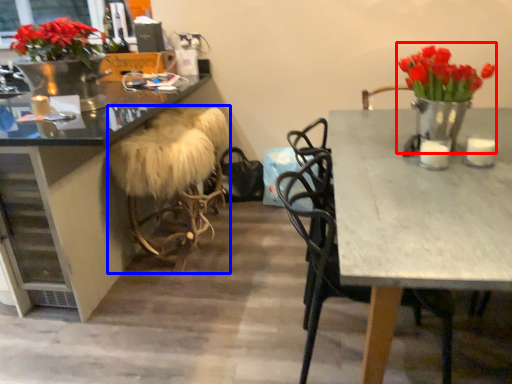
Question: Among these objects, which one is nearest to the camera, floral arrangement (highlighted by a red box) or stool (highlighted by a blue box)?

Choices:
 (A) floral arrangement
 (B) stool

Answer: (A)